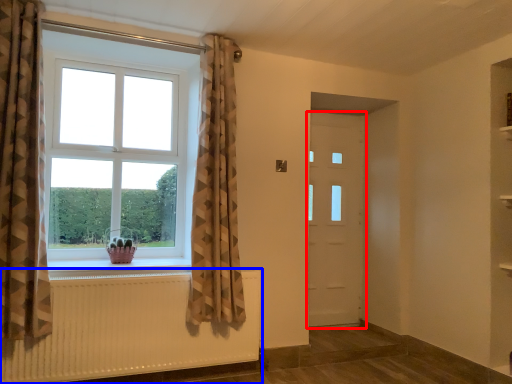
Question: Which object is further to the camera taking this photo, door (highlighted by a red box) or radiator (highlighted by a blue box)?

Choices:
 (A) door
 (B) radiator

Answer: (A)